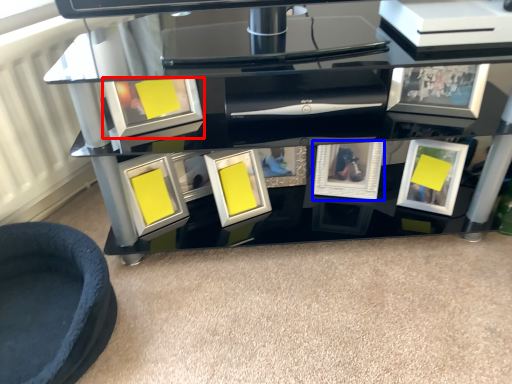
Question: Among these objects, which one is farthest to the camera, picture frame (highlighted by a red box) or picture frame (highlighted by a blue box)?

Choices:
 (A) picture frame
 (B) picture frame

Answer: (B)